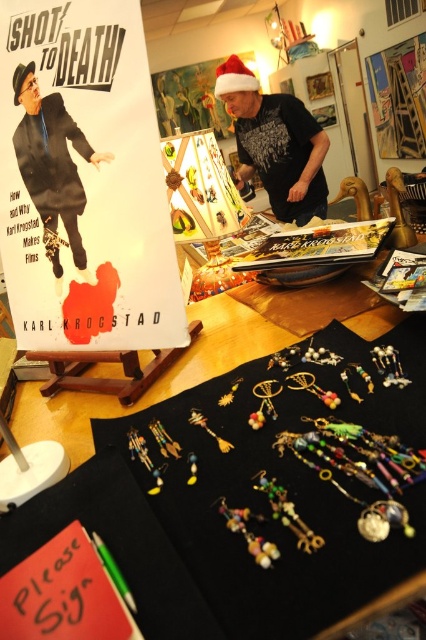
From the picture: Is multicolored beaded earrings at center below matte black shirt at upper center?

Yes.

Is the position of multicolored beaded earrings at center more distant than that of matte black shirt at upper center?

No.

Which is in front, point (198, 472) or point (224, 83)?

Point (198, 472) is in front.

The height and width of the screenshot is (640, 426). In order to click on multicolored beaded earrings at center in this screenshot , I will do `click(299, 436)`.

Is point (198, 566) behind point (161, 272)?

No, (198, 566) is in front of (161, 272).

Identify the location of black fabric at center. The height and width of the screenshot is (640, 426). (247, 500).

Does point (37, 150) lie in front of point (74, 179)?

No, it is behind (74, 179).

How far apart are matte black poster at upper left and matte black suit at upper left?

matte black poster at upper left and matte black suit at upper left are 1.46 inches apart.

Does point (69, 17) lie behind point (77, 193)?

No, (69, 17) is closer to viewer.

The image size is (426, 640). I want to click on matte black poster at upper left, so (83, 180).